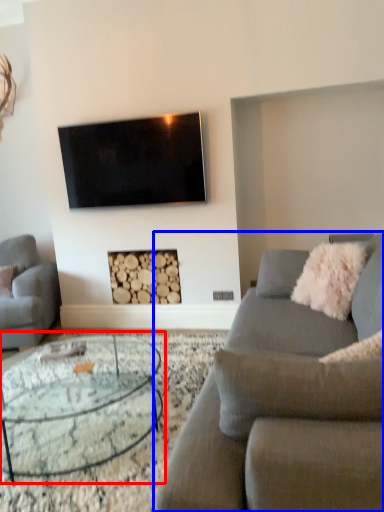
Question: Which object appears farthest to the camera in this image, coffee table (highlighted by a red box) or studio couch (highlighted by a blue box)?

Choices:
 (A) coffee table
 (B) studio couch

Answer: (A)